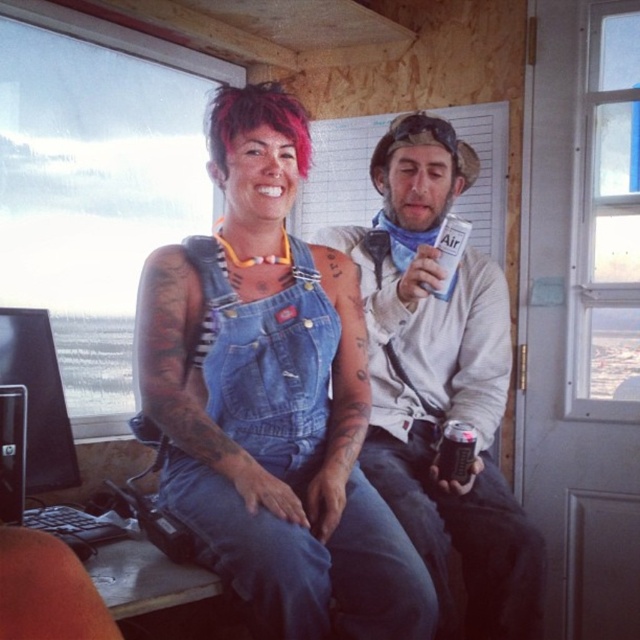
Is point (234, 145) closer to viewer compared to point (49, 579)?

No.

Who is positioned more to the left, denim overalls at center or orange matte keyboard at lower left?

orange matte keyboard at lower left

You are a GUI agent. You are given a task and a screenshot of the screen. Output one action in this format:
    pyautogui.click(x=<x>, y=<y>)
    Task: Click on the denim overalls at center
    This screenshot has height=640, width=640.
    Given the screenshot: What is the action you would take?
    pyautogui.click(x=273, y=397)

Can you confirm if denim jacket at center is positioned above orange matte keyboard at lower left?

Correct, denim jacket at center is located above orange matte keyboard at lower left.

Does denim jacket at center have a greater width compared to orange matte keyboard at lower left?

Indeed, denim jacket at center has a greater width compared to orange matte keyboard at lower left.

Who is more forward, (x=508, y=310) or (x=104, y=625)?

Point (x=104, y=625)

Locate an element on the screen. This screenshot has width=640, height=640. denim jacket at center is located at coordinates (440, 381).

Between denim overalls at center and pink dyed hair at upper center, which one appears on the left side from the viewer's perspective?

Positioned to the left is pink dyed hair at upper center.

Where is `denim overalls at center`? Image resolution: width=640 pixels, height=640 pixels. denim overalls at center is located at coordinates (273, 397).

Does point (392, 586) come farther from viewer compared to point (300, 104)?

No, (392, 586) is in front of (300, 104).

This screenshot has width=640, height=640. Find the location of `denim overalls at center`. denim overalls at center is located at coordinates (273, 397).